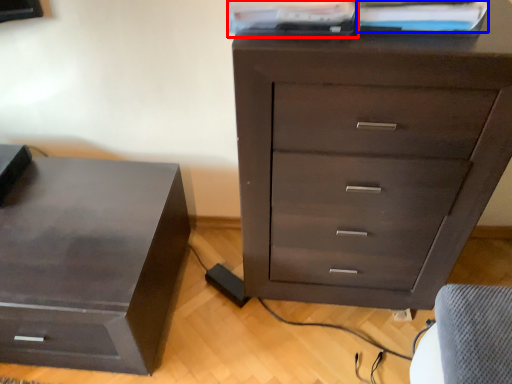
Question: Among these objects, which one is farthest to the camera, book (highlighted by a red box) or book (highlighted by a blue box)?

Choices:
 (A) book
 (B) book

Answer: (B)